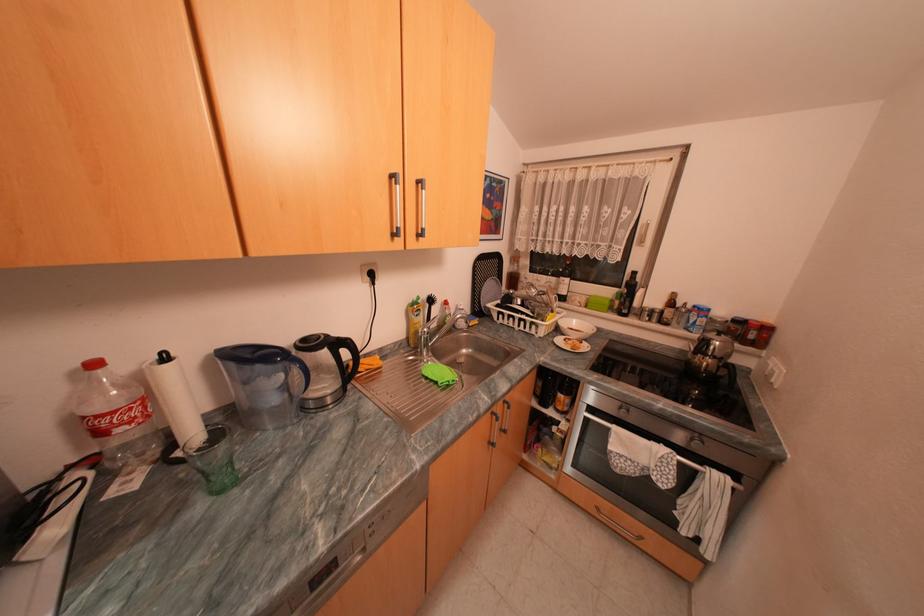
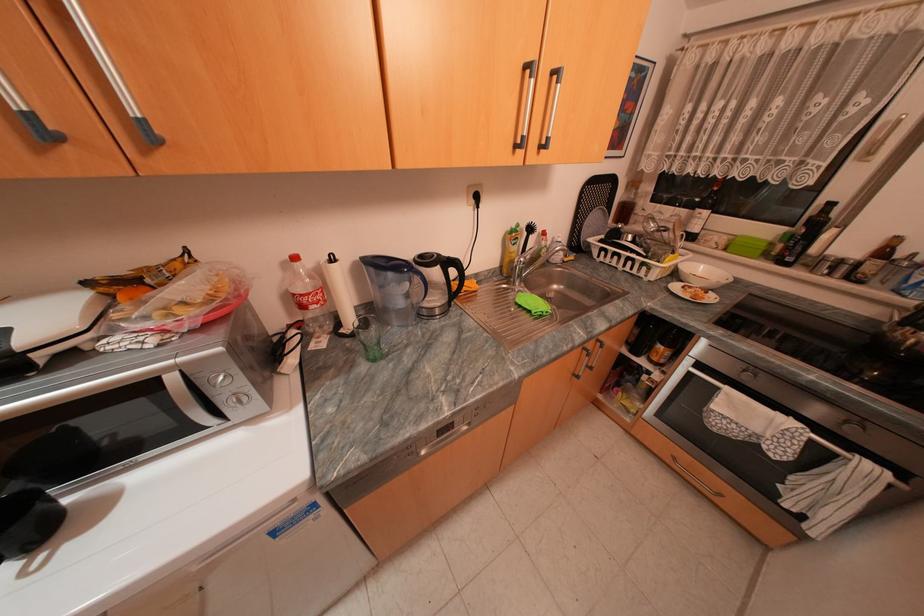
In the second image, find the point that corresponds to [566,330] in the first image.

(685, 275)